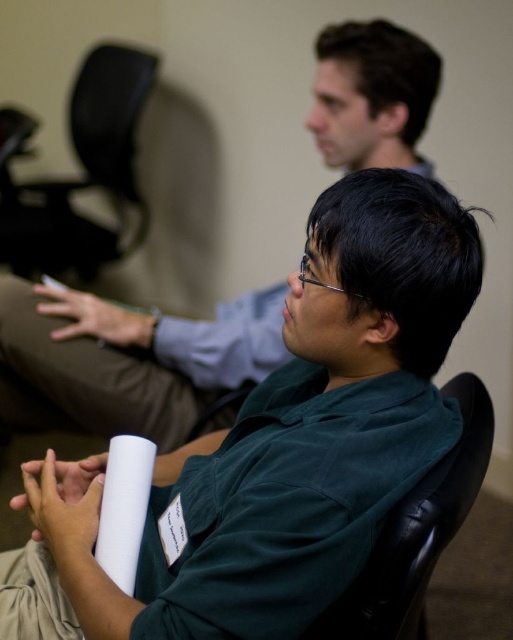
Question: Is green matte shirt at center positioned at the back of black leather swivel chair at left?

Choices:
 (A) yes
 (B) no

Answer: (B)

Question: Among these points, which one is nearest to the camera?

Choices:
 (A) (463, 481)
 (B) (3, 212)
 (C) (386, 131)

Answer: (A)

Question: Based on their relative distances, which object is nearer to the black leather swivel chair at left?

Choices:
 (A) black leather chair at center
 (B) green fabric shirt at center

Answer: (B)

Question: Can you confirm if green fabric shirt at center is bigger than black leather chair at center?

Choices:
 (A) no
 (B) yes

Answer: (B)

Question: Does green fabric shirt at center appear over black leather chair at center?

Choices:
 (A) no
 (B) yes

Answer: (B)

Question: Estimate the real-world distances between objects in this image. Which object is farther from the black leather swivel chair at left?

Choices:
 (A) green matte shirt at center
 (B) green fabric shirt at center
 (C) black leather chair at center

Answer: (C)